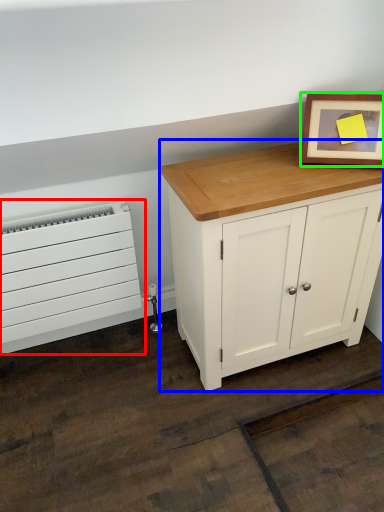
Question: Considering the real-world distances, which object is farthest from heater (highlighted by a red box)? chest of drawers (highlighted by a blue box) or picture frame (highlighted by a green box)?

Choices:
 (A) chest of drawers
 (B) picture frame

Answer: (B)